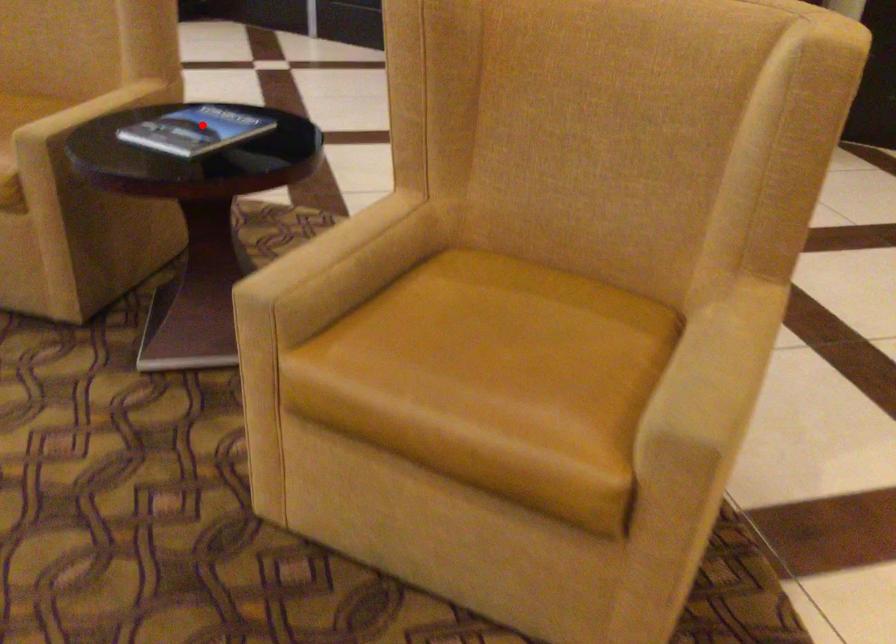
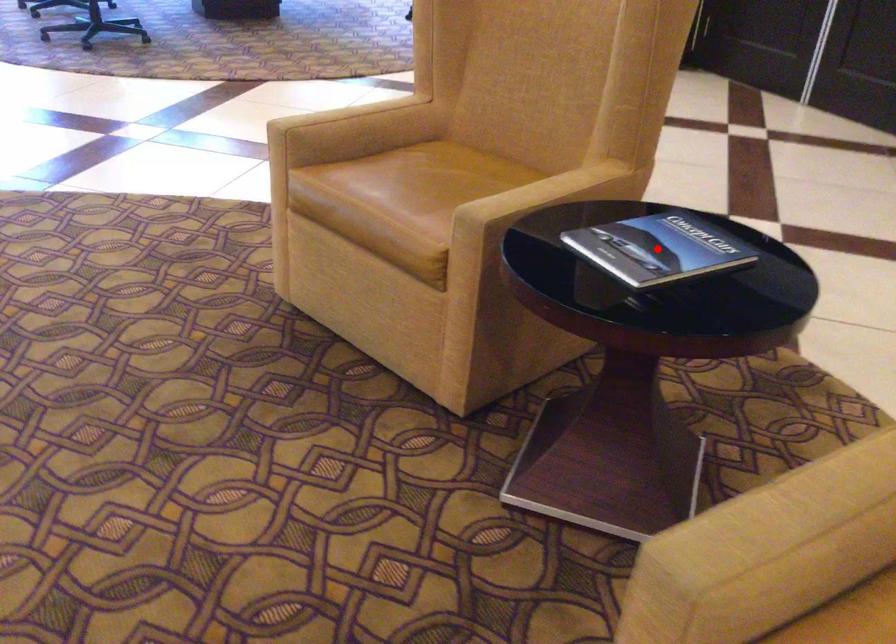
I am providing you with two images of the same scene from different viewpoints. A red point is marked on the first image and another point is marked on the second image. Are the points marked in image1 and image2 representing the same 3D position?

Yes